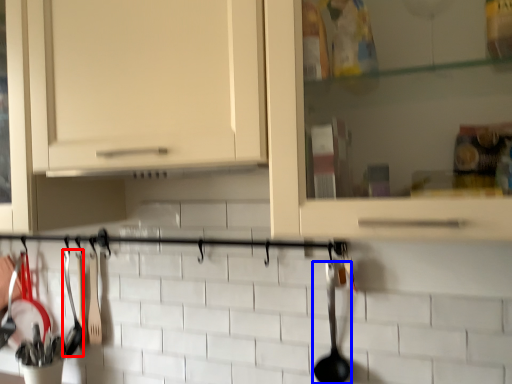
Question: Which object appears closest to the camera in this image, silverware (highlighted by a red box) or silverware (highlighted by a blue box)?

Choices:
 (A) silverware
 (B) silverware

Answer: (B)